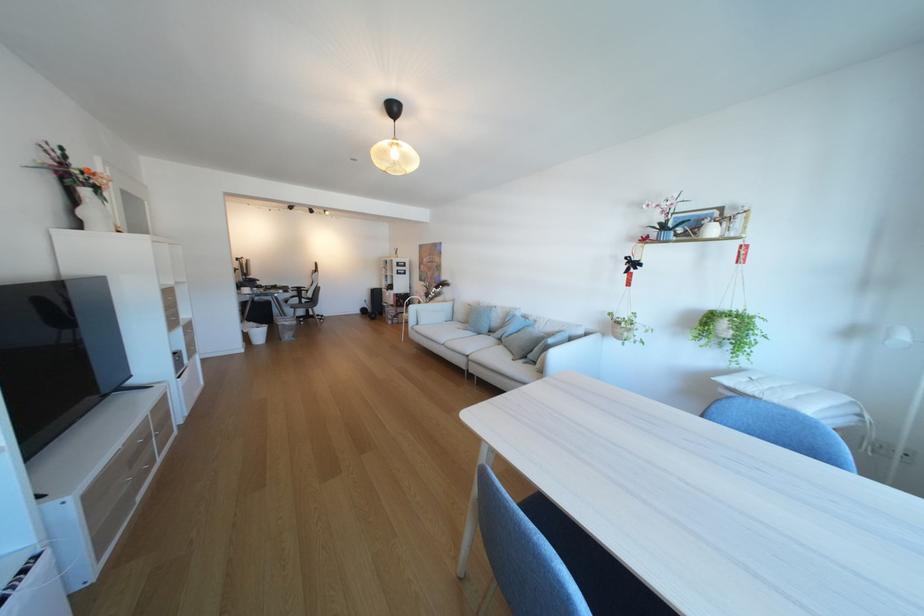
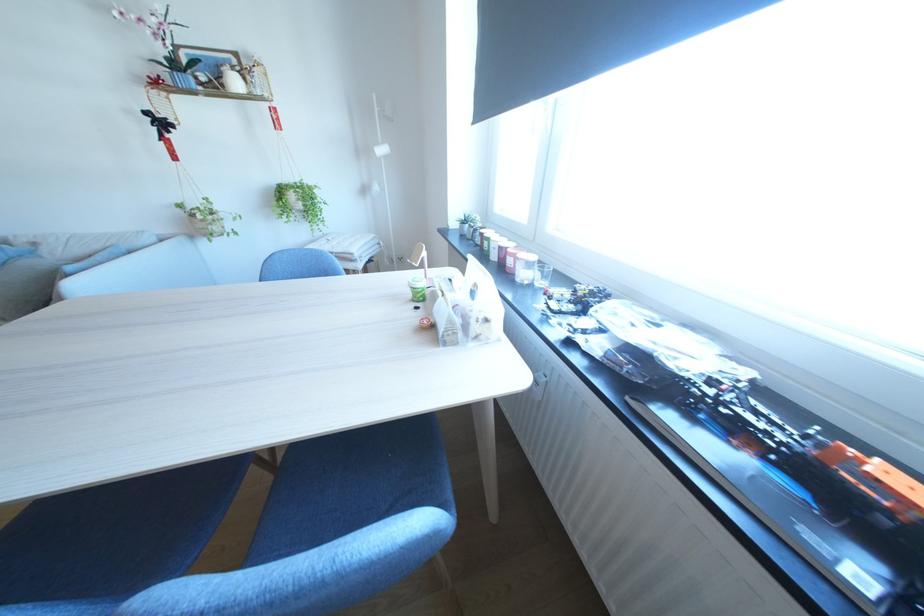
The point at (621, 315) is marked in the first image. Where is the corresponding point in the second image?

(190, 207)